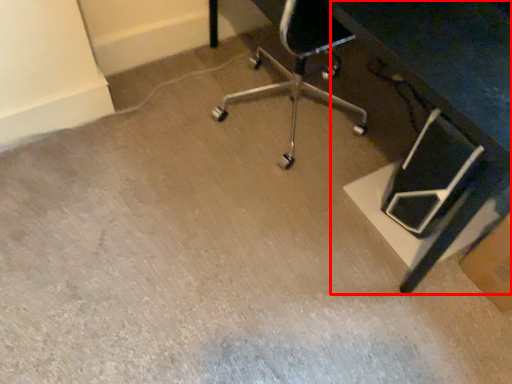
Question: Where is table (annotated by the red box) located in relation to cardboard box in the image?

Choices:
 (A) left
 (B) right

Answer: (A)